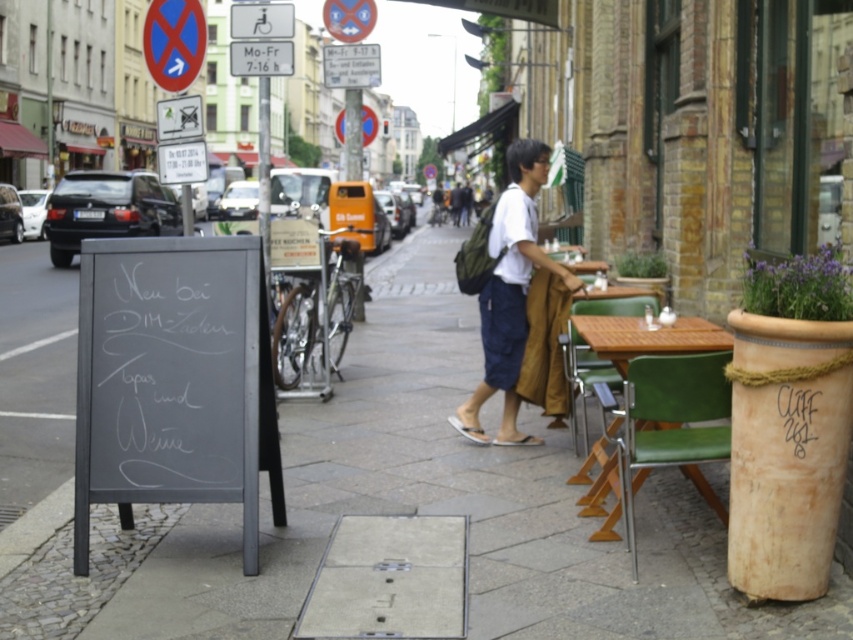
Question: Can you confirm if smooth concrete pavement at center is thinner than blue circular sign at upper left?

Choices:
 (A) yes
 (B) no

Answer: (B)

Question: Among these objects, which one is farthest from the camera?

Choices:
 (A) white plastic sign at upper center
 (B) black chalkboard at lower left

Answer: (A)

Question: Is black chalkboard at lower left closer to the viewer compared to wooden table at right?

Choices:
 (A) no
 (B) yes

Answer: (B)

Question: Which point appears farthest from the camera in this image?

Choices:
 (A) (544, 154)
 (B) (219, 292)
 (C) (187, 86)

Answer: (C)

Question: Which point appears farthest from the camera in this image?

Choices:
 (A) (167, 29)
 (B) (456, 304)
 (C) (457, 412)
 (D) (241, 68)

Answer: (B)

Question: Can you confirm if wooden table at right is positioned to the right of white plastic sign at upper center?

Choices:
 (A) yes
 (B) no

Answer: (A)